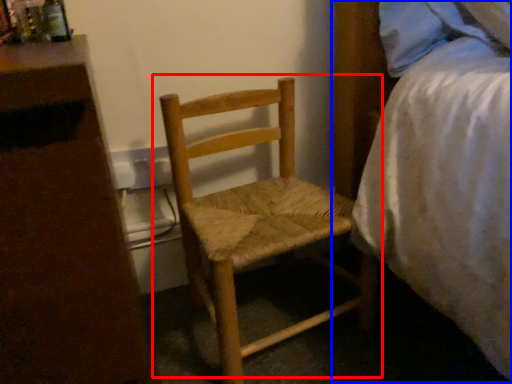
Question: Which point is closer to the camera, chair (highlighted by a red box) or bed (highlighted by a blue box)?

Choices:
 (A) chair
 (B) bed

Answer: (B)